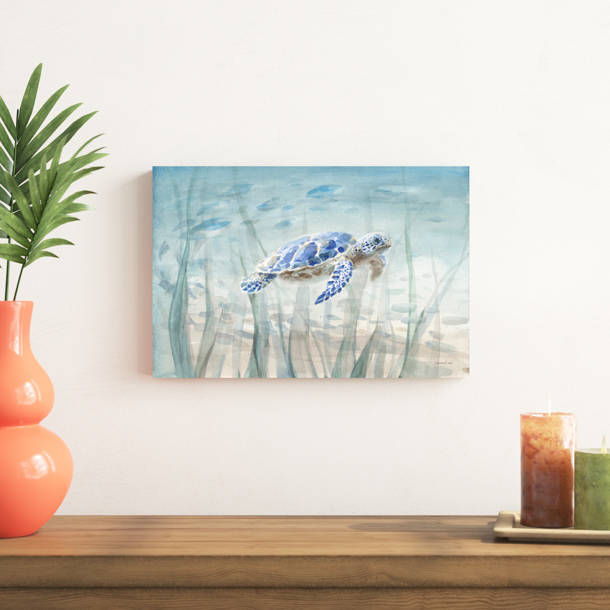
The width and height of the screenshot is (610, 610). I want to click on wall to right of painting, so 551,282.